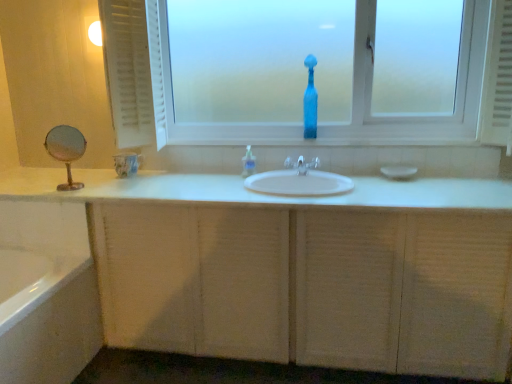
Identify the location of vacant space to the right of translucent plastic soap dispenser at center. (273, 166).